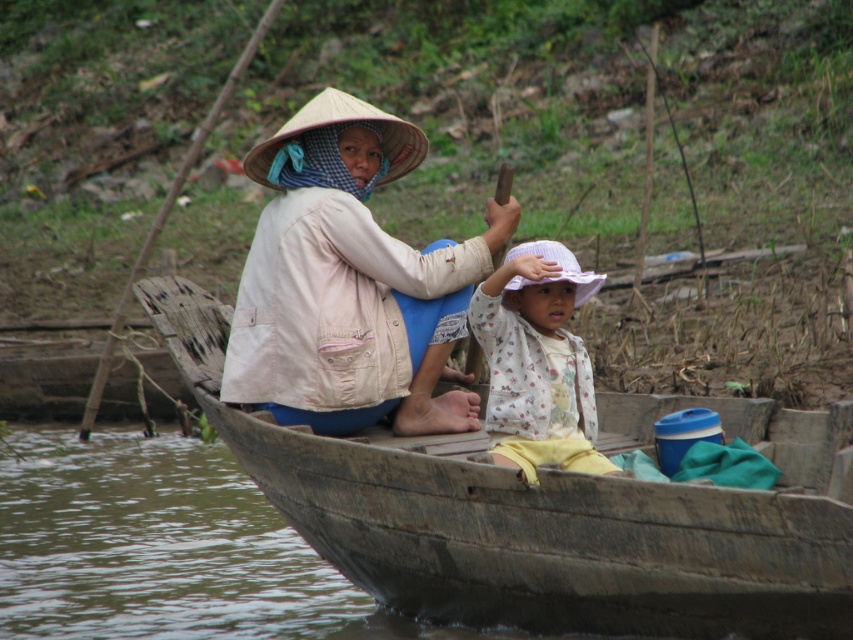
Between point (383, 524) and point (563, 307), which one is positioned in front?

Point (383, 524) is more forward.

Can you confirm if wooden boat at center is bigger than white floral shirt at center?

No.

Locate an element on the screen. The height and width of the screenshot is (640, 853). wooden boat at center is located at coordinates (550, 513).

Based on the photo, is wooden boat at center to the left of beige cotton jacket at center from the viewer's perspective?

Incorrect, wooden boat at center is not on the left side of beige cotton jacket at center.

Does wooden boat at center have a greater height compared to beige cotton jacket at center?

In fact, wooden boat at center may be shorter than beige cotton jacket at center.

The width and height of the screenshot is (853, 640). In order to click on wooden boat at center in this screenshot , I will do `click(550, 513)`.

Is beige cotton jacket at center positioned in front of white floral shirt at center?

No, beige cotton jacket at center is behind white floral shirt at center.

Where is `beige cotton jacket at center`? beige cotton jacket at center is located at coordinates (349, 282).